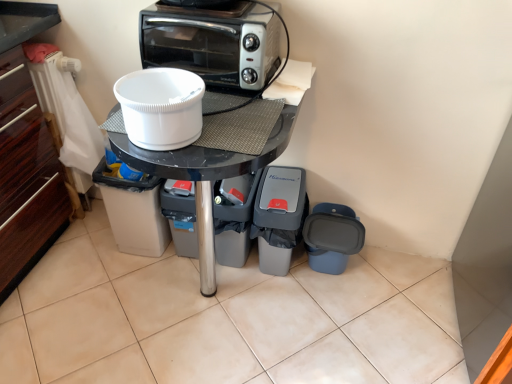
Where is `vacant space in front of gray plastic trash can at lower center, which is the 3th appliance from left to right`? The width and height of the screenshot is (512, 384). vacant space in front of gray plastic trash can at lower center, which is the 3th appliance from left to right is located at coordinates (233, 290).